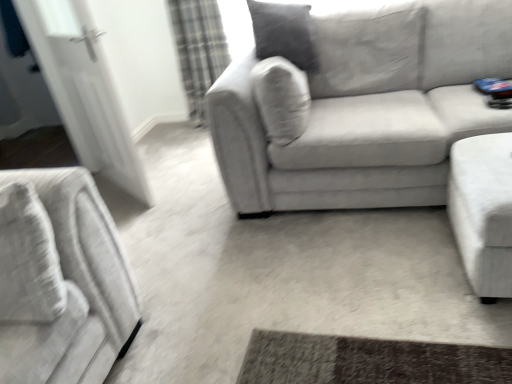
Question: Could you tell me if velvet gray couch at center, acting as the first studio couch starting from the left, is turned towards white fabric ottoman at right, which is counted as the second studio couch, starting from the left?

Choices:
 (A) no
 (B) yes

Answer: (B)

Question: From the image's perspective, does velvet gray couch at center, which is the second studio couch from right to left, appear higher than white fabric ottoman at right, which is counted as the second studio couch, starting from the left?

Choices:
 (A) yes
 (B) no

Answer: (A)

Question: Is velvet gray couch at center, acting as the first studio couch starting from the left, smaller than white fabric ottoman at right, arranged as the 1th studio couch when viewed from the right?

Choices:
 (A) no
 (B) yes

Answer: (A)

Question: Is velvet gray couch at center, acting as the first studio couch starting from the left, further to the viewer compared to white fabric ottoman at right, which is counted as the second studio couch, starting from the left?

Choices:
 (A) yes
 (B) no

Answer: (A)

Question: From the image's perspective, is velvet gray couch at center, acting as the first studio couch starting from the left, under white fabric ottoman at right, arranged as the 1th studio couch when viewed from the right?

Choices:
 (A) yes
 (B) no

Answer: (B)

Question: Is plaid fabric curtain at upper left in front of or behind white glossy door at left in the image?

Choices:
 (A) front
 (B) behind

Answer: (B)

Question: From a real-world perspective, is plaid fabric curtain at upper left above or below white glossy door at left?

Choices:
 (A) below
 (B) above

Answer: (A)

Question: In terms of height, does plaid fabric curtain at upper left look taller or shorter compared to white glossy door at left?

Choices:
 (A) tall
 (B) short

Answer: (B)

Question: Is point (185, 1) positioned closer to the camera than point (57, 39)?

Choices:
 (A) farther
 (B) closer

Answer: (A)

Question: In the image, is velvet gray couch at center, which is the second studio couch from right to left, on the left side or the right side of white glossy door at left?

Choices:
 (A) right
 (B) left

Answer: (A)

Question: Would you say velvet gray couch at center, which is the second studio couch from right to left, is inside or outside white glossy door at left?

Choices:
 (A) inside
 (B) outside

Answer: (B)

Question: Looking at their shapes, would you say velvet gray couch at center, which is the second studio couch from right to left, is wider or thinner than white glossy door at left?

Choices:
 (A) wide
 (B) thin

Answer: (A)

Question: Is point (373, 4) positioned closer to the camera than point (141, 183)?

Choices:
 (A) closer
 (B) farther

Answer: (A)

Question: Relative to velvet gray couch at center, which is the second studio couch from right to left, is plaid fabric curtain at upper left in front or behind?

Choices:
 (A) behind
 (B) front

Answer: (A)

Question: Is point (182, 34) positioned closer to the camera than point (355, 124)?

Choices:
 (A) farther
 (B) closer

Answer: (A)